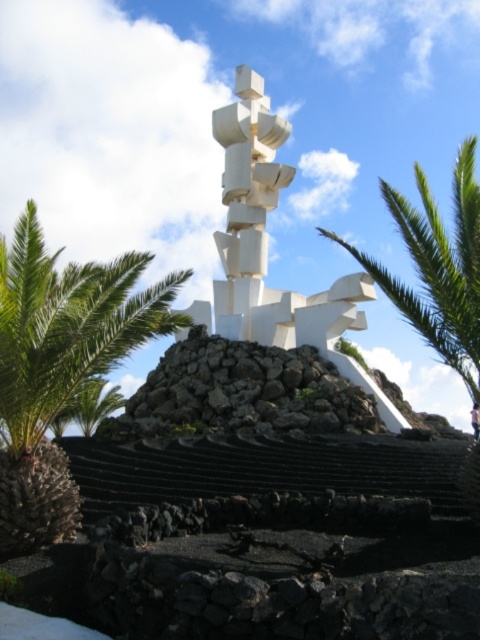
Does green leafy palm at center lie behind green leafy palm at right?

That is False.

Is green leafy palm at center to the left of green leafy palm at right from the viewer's perspective?

Indeed, green leafy palm at center is positioned on the left side of green leafy palm at right.

This screenshot has height=640, width=480. In order to click on green leafy palm at center in this screenshot , I will do `click(60, 365)`.

Locate an element on the screen. green leafy palm at center is located at coordinates click(60, 365).